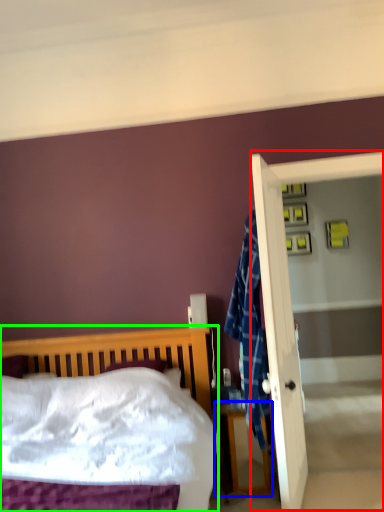
Question: Considering the real-world distances, which object is farthest from screen door (highlighted by a red box)? nightstand (highlighted by a blue box) or bed (highlighted by a green box)?

Choices:
 (A) nightstand
 (B) bed

Answer: (B)